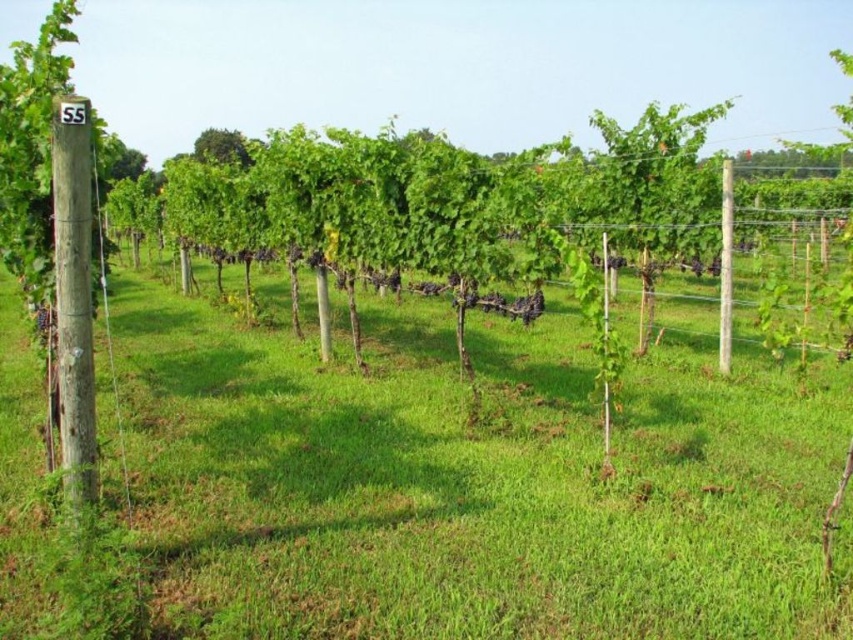
Question: Which object is positioned closest to the green grass at center?

Choices:
 (A) white wood pole at center
 (B) green leafy tree at upper center
 (C) brown wooden post at left

Answer: (C)

Question: Does white wood pole at center appear under green leafy tree at upper center?

Choices:
 (A) yes
 (B) no

Answer: (A)

Question: Which point is closer to the camera?

Choices:
 (A) (444, 426)
 (B) (194, 154)
 (C) (59, 276)
 (D) (726, 180)

Answer: (C)

Question: Can you confirm if brown wooden post at left is bigger than green leafy tree at upper center?

Choices:
 (A) yes
 (B) no

Answer: (B)

Question: Where is brown wooden post at left located in relation to white wood pole at center in the image?

Choices:
 (A) above
 (B) below

Answer: (B)

Question: Which point is closer to the camera?

Choices:
 (A) (720, 310)
 (B) (460, 432)
 (C) (209, 140)

Answer: (B)